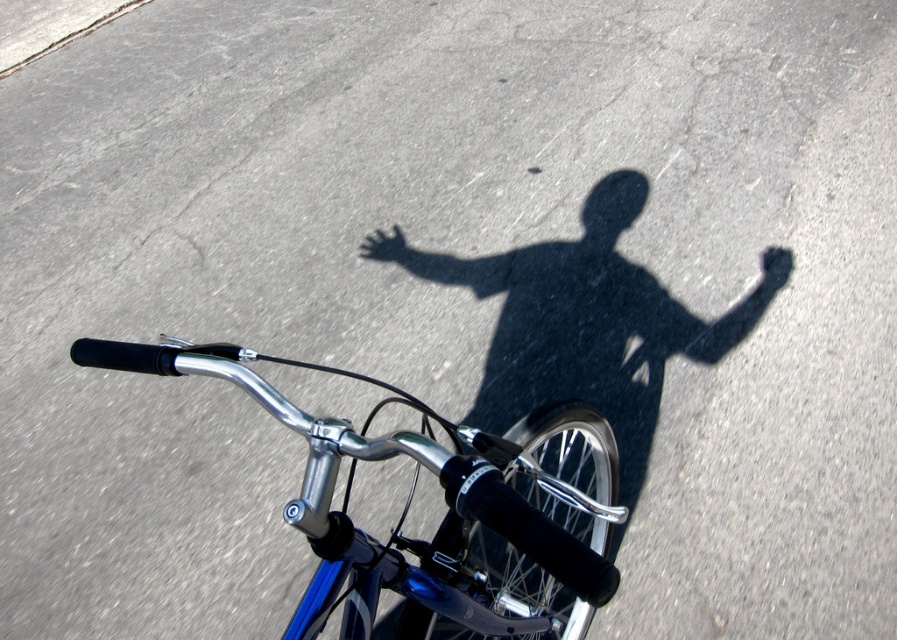
Question: Which point appears farthest from the camera in this image?

Choices:
 (A) (384, 253)
 (B) (565, 417)

Answer: (A)

Question: Can you confirm if shiny blue bicycle handlebars at center is thinner than matte black hand at center?

Choices:
 (A) no
 (B) yes

Answer: (A)

Question: Which point is closer to the camera taking this photo?

Choices:
 (A) (329, 500)
 (B) (392, 236)

Answer: (A)

Question: Among these objects, which one is nearest to the camera?

Choices:
 (A) matte black hand at center
 (B) shiny blue bicycle handlebars at center

Answer: (B)

Question: Where is shiny blue bicycle handlebars at center located in relation to matte black hand at center in the image?

Choices:
 (A) left
 (B) right

Answer: (B)

Question: Does shiny blue bicycle handlebars at center appear over matte black hand at center?

Choices:
 (A) no
 (B) yes

Answer: (A)